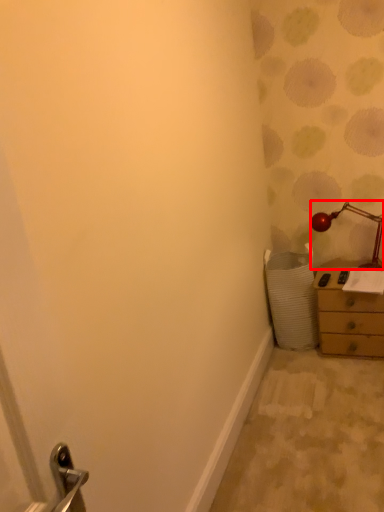
Question: From the image's perspective, where is lamp (annotated by the red box) located relative to chest of drawers?

Choices:
 (A) below
 (B) above

Answer: (B)